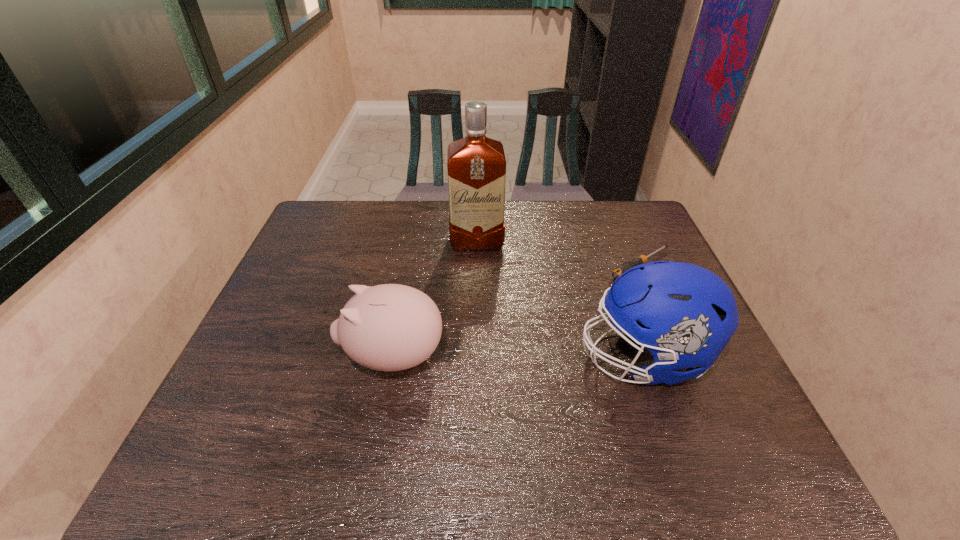
I want to click on free spot on the desktop that is between the piggy bank and the football helmet and is positioned on the front label of the tallest object, so click(x=485, y=357).

Where is `vacant space on the desktop that is between the third tallest object and the third shortest object and is positioned at the tip of the shortest object`? Image resolution: width=960 pixels, height=540 pixels. vacant space on the desktop that is between the third tallest object and the third shortest object and is positioned at the tip of the shortest object is located at coordinates (487, 357).